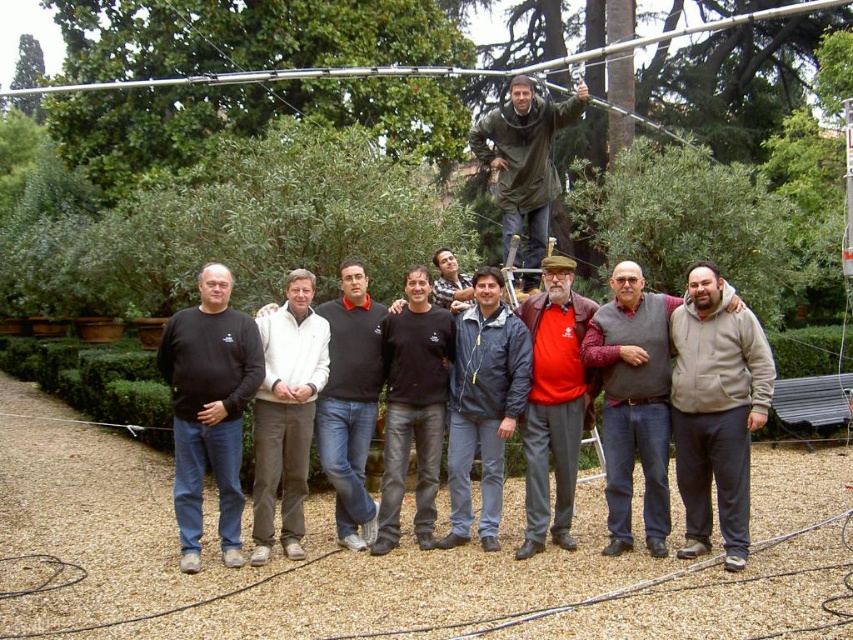
Question: Among these points, which one is farthest from the camera?

Choices:
 (A) (614, 291)
 (B) (204, 304)
 (C) (520, 216)
 (D) (744, 420)

Answer: (C)

Question: Can you confirm if gray fleece jacket at center is smaller than red leather jacket at center?

Choices:
 (A) yes
 (B) no

Answer: (A)

Question: Which of the following is the farthest from the observer?

Choices:
 (A) (355, 442)
 (B) (532, 198)
 (C) (653, 397)
 (D) (740, 381)

Answer: (B)

Question: Which object appears farthest from the camera in this image?

Choices:
 (A) red leather jacket at center
 (B) dark blue jacket at center
 (C) black matte shirt at center

Answer: (C)

Question: Can you confirm if black cotton shirt at center is positioned to the left of green matte jacket at upper center?

Choices:
 (A) no
 (B) yes

Answer: (B)

Question: Where is black cotton sweatshirt at center located in relation to green matte jacket at upper center in the image?

Choices:
 (A) right
 (B) left

Answer: (A)